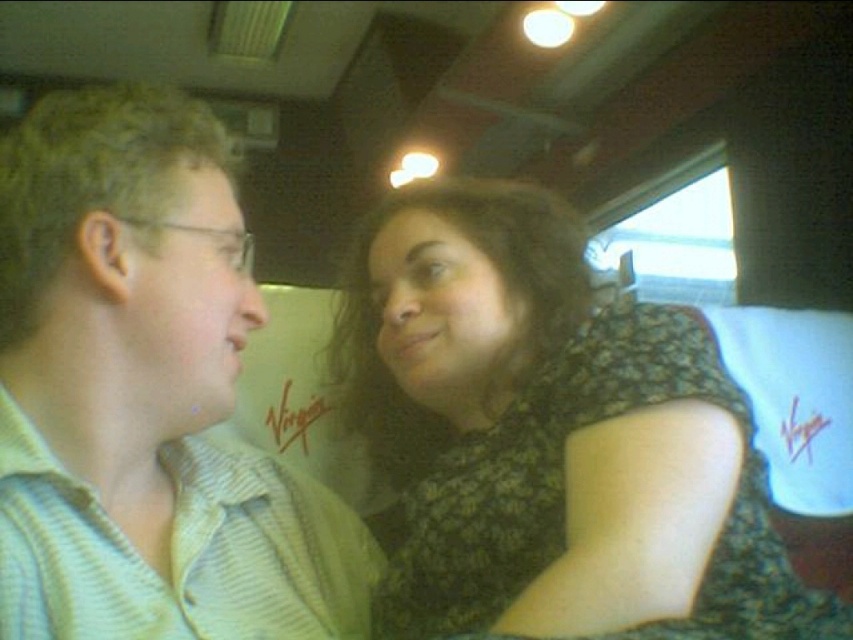
You are a photographer trying to capture a candid shot of the two people in the train scene. Your camera has a minimum focus distance of 25 centimeters. Based on the scene, will you be able to focus on both the black lace dress at center and the striped cotton shirt at left simultaneously?

The distance between the black lace dress at center and the striped cotton shirt at left is 24.12 centimeters. Since the minimum focus distance of your camera is 25 centimeters, the camera cannot focus on both objects simultaneously as they are closer than the required distance.

You are standing 36.49 inches away from a point in a train carriage scene. The scene shows two people sitting close together near a window. Can you estimate how far you are from the point marked at coordinates point (393, 260)?

The point marked at coordinates point (393, 260) is 36.49 inches away from you.